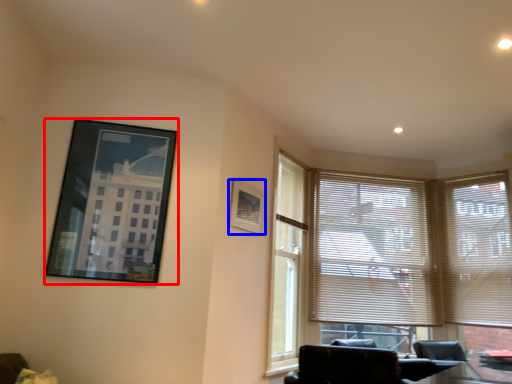
Question: Which object is further to the camera taking this photo, picture frame (highlighted by a red box) or picture frame (highlighted by a blue box)?

Choices:
 (A) picture frame
 (B) picture frame

Answer: (B)